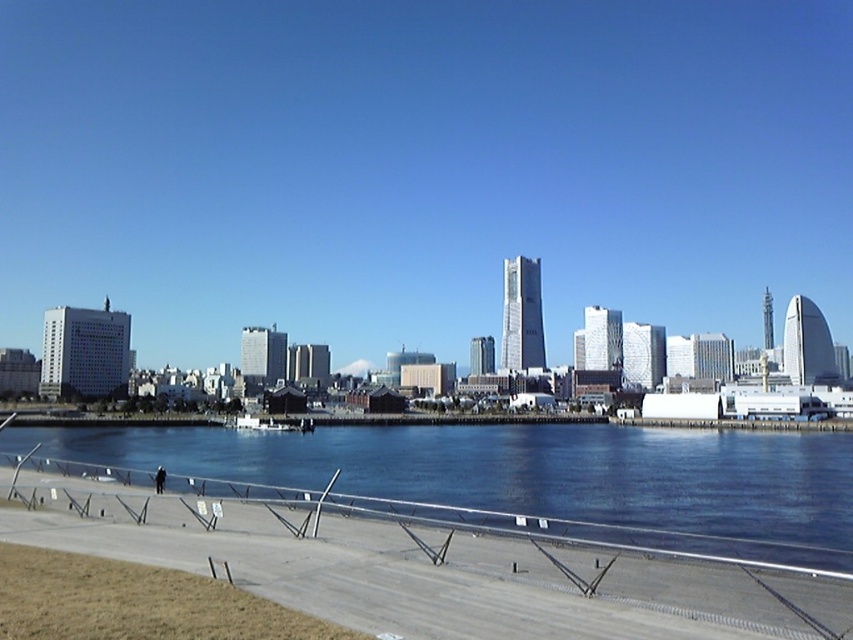
Looking at this image, can you confirm if blue glassy water at lower center is positioned to the left of brown grass at lower left?

Yes, blue glassy water at lower center is to the left of brown grass at lower left.

Is blue glassy water at lower center positioned before brown grass at lower left?

No, it is not.

Where is `blue glassy water at lower center`? The height and width of the screenshot is (640, 853). blue glassy water at lower center is located at coordinates (527, 476).

This screenshot has height=640, width=853. Describe the element at coordinates (421, 166) in the screenshot. I see `transparent glass skyscrapers at center` at that location.

How far apart are transparent glass skyscrapers at center and blue glassy water at lower center?

They are 204.45 meters apart.

Who is more forward, (51, 68) or (543, 468)?

Point (543, 468) is more forward.

Locate an element on the screen. This screenshot has height=640, width=853. transparent glass skyscrapers at center is located at coordinates (421, 166).

Can you confirm if transparent glass skyscrapers at center is shorter than brown grass at lower left?

→ In fact, transparent glass skyscrapers at center may be taller than brown grass at lower left.

Does point (184, 99) come closer to viewer compared to point (194, 598)?

No, it is not.

Image resolution: width=853 pixels, height=640 pixels. What do you see at coordinates (421, 166) in the screenshot?
I see `transparent glass skyscrapers at center` at bounding box center [421, 166].

Find the location of a particular element. Image resolution: width=853 pixels, height=640 pixels. transparent glass skyscrapers at center is located at coordinates [421, 166].